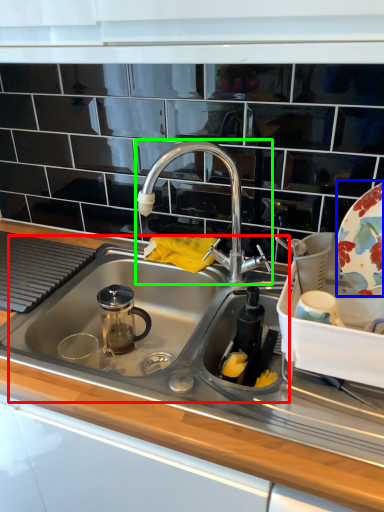
Question: Considering the real-world distances, which object is farthest from sink (highlighted by a red box)? platter (highlighted by a blue box) or tap (highlighted by a green box)?

Choices:
 (A) platter
 (B) tap

Answer: (A)